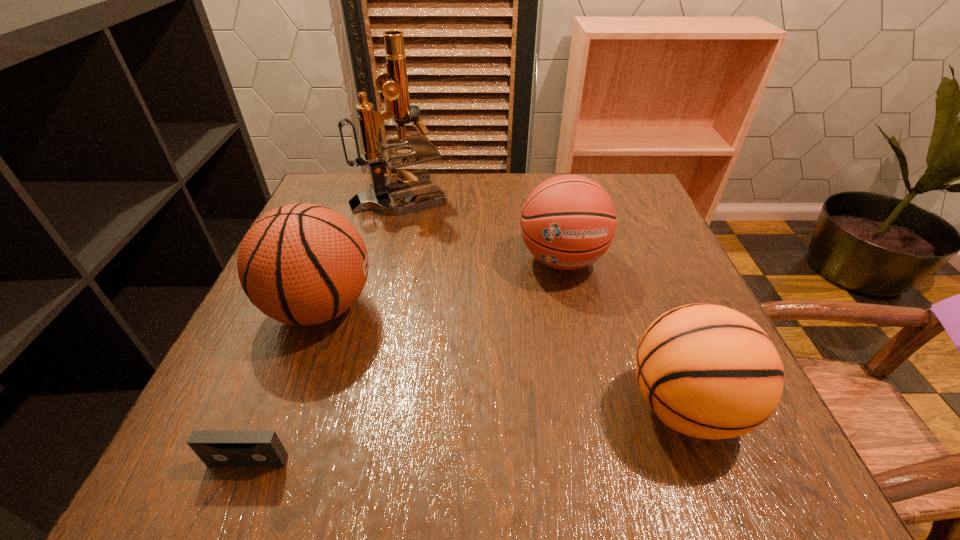
Locate an element on the screen. This screenshot has width=960, height=540. the farthest object is located at coordinates (394, 84).

Where is `microscope`? The width and height of the screenshot is (960, 540). microscope is located at coordinates (394, 84).

Locate an element on the screen. The width and height of the screenshot is (960, 540). the leftmost basketball is located at coordinates (304, 264).

Image resolution: width=960 pixels, height=540 pixels. I want to click on the nearest basketball, so click(708, 371).

Image resolution: width=960 pixels, height=540 pixels. In order to click on the shortest object in this screenshot , I will do `click(215, 448)`.

Image resolution: width=960 pixels, height=540 pixels. I want to click on free space located 0.230m at the eyepiece of the farthest object, so click(536, 194).

In order to click on vacant space located 0.270m on the side where the inflation valve is located in this screenshot , I will do `click(516, 307)`.

You are a GUI agent. You are given a task and a screenshot of the screen. Output one action in this format:
    pyautogui.click(x=<x>, y=<y>)
    Task: Click on the vacant space located 0.050m on the left of the nearest basketball
    This screenshot has height=540, width=960.
    Given the screenshot: What is the action you would take?
    [x=594, y=406]

Where is `object that is at the far edge`? The width and height of the screenshot is (960, 540). object that is at the far edge is located at coordinates (394, 84).

Find the location of `basketball that is at the near edge`. basketball that is at the near edge is located at coordinates coord(708,371).